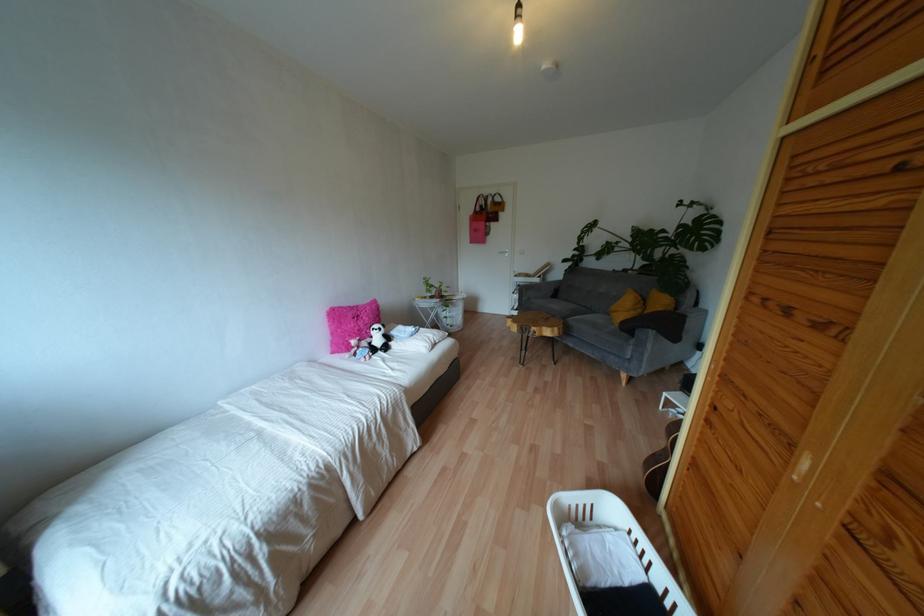
The width and height of the screenshot is (924, 616). I want to click on gray sofa sitting surface, so click(x=569, y=310).